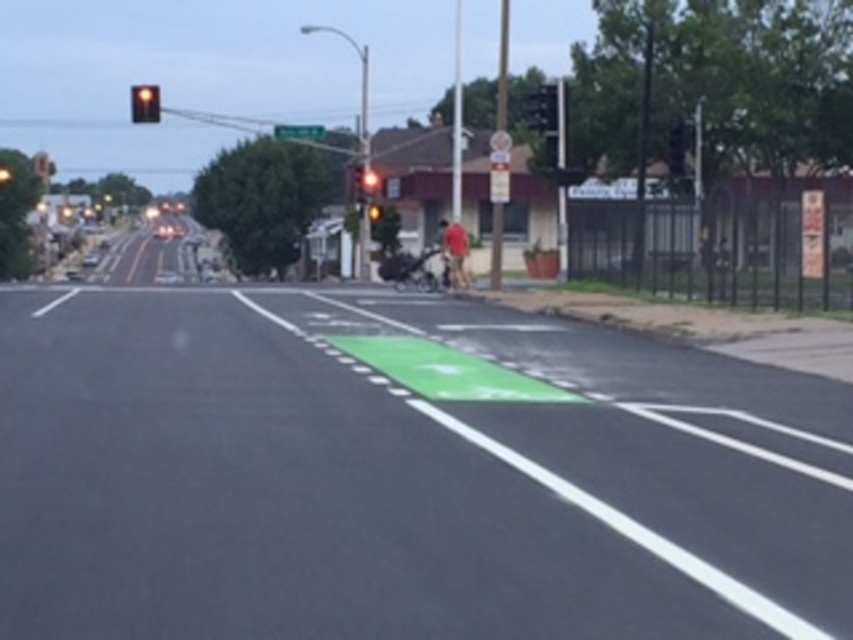
Question: Which point is farther to the camera?

Choices:
 (A) (158, 120)
 (B) (850, 484)

Answer: (A)

Question: Estimate the real-world distances between objects in this image. Which object is closer to the metallic pole at right?

Choices:
 (A) green asphalt at center
 (B) amber glass traffic light at upper center

Answer: (A)

Question: Which point is closer to the camera?

Choices:
 (A) (184, 392)
 (B) (283, 131)

Answer: (A)

Question: Does green asphalt at center appear under amber glass traffic light at upper center?

Choices:
 (A) no
 (B) yes

Answer: (B)

Question: In this image, where is metallic pole at right located relative to green plastic street sign at upper center?

Choices:
 (A) right
 (B) left

Answer: (A)

Question: Does metallic pole at right have a lesser width compared to amber glass traffic light at upper center?

Choices:
 (A) yes
 (B) no

Answer: (A)